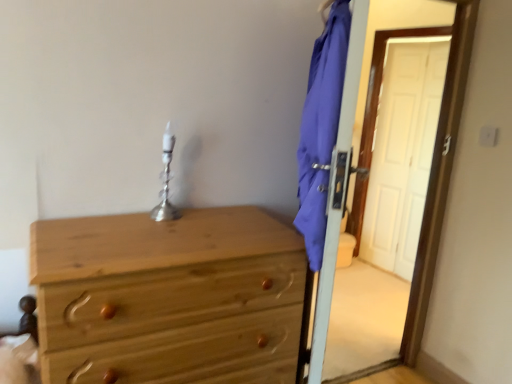
Question: Is blue fabric screen door at right in front of silver metallic table lamp at center?

Choices:
 (A) no
 (B) yes

Answer: (B)

Question: Can you confirm if blue fabric screen door at right is taller than silver metallic table lamp at center?

Choices:
 (A) yes
 (B) no

Answer: (A)

Question: Can we say blue fabric screen door at right lies outside silver metallic table lamp at center?

Choices:
 (A) no
 (B) yes

Answer: (B)

Question: Can you confirm if blue fabric screen door at right is bigger than silver metallic table lamp at center?

Choices:
 (A) yes
 (B) no

Answer: (A)

Question: Is blue fabric screen door at right turned away from silver metallic table lamp at center?

Choices:
 (A) yes
 (B) no

Answer: (A)

Question: Would you say blue fabric screen door at right is inside or outside silver metallic table lamp at center?

Choices:
 (A) inside
 (B) outside

Answer: (B)

Question: Considering their positions, is blue fabric screen door at right located in front of or behind silver metallic table lamp at center?

Choices:
 (A) front
 (B) behind

Answer: (A)

Question: Is point 407,344 closer or farther from the camera than point 163,173?

Choices:
 (A) closer
 (B) farther

Answer: (B)

Question: From the image's perspective, is blue fabric screen door at right located above or below silver metallic table lamp at center?

Choices:
 (A) below
 (B) above

Answer: (A)

Question: In the image, is natural wood chest of drawers at left on the left side or the right side of silver metallic table lamp at center?

Choices:
 (A) left
 (B) right

Answer: (B)

Question: From the image's perspective, is natural wood chest of drawers at left positioned above or below silver metallic table lamp at center?

Choices:
 (A) above
 (B) below

Answer: (B)

Question: Is natural wood chest of drawers at left inside or outside of silver metallic table lamp at center?

Choices:
 (A) outside
 (B) inside

Answer: (A)

Question: Looking at their shapes, would you say natural wood chest of drawers at left is wider or thinner than silver metallic table lamp at center?

Choices:
 (A) wide
 (B) thin

Answer: (A)

Question: Looking at their shapes, would you say blue fabric screen door at right is wider or thinner than natural wood chest of drawers at left?

Choices:
 (A) wide
 (B) thin

Answer: (B)

Question: Is blue fabric screen door at right taller or shorter than natural wood chest of drawers at left?

Choices:
 (A) short
 (B) tall

Answer: (B)